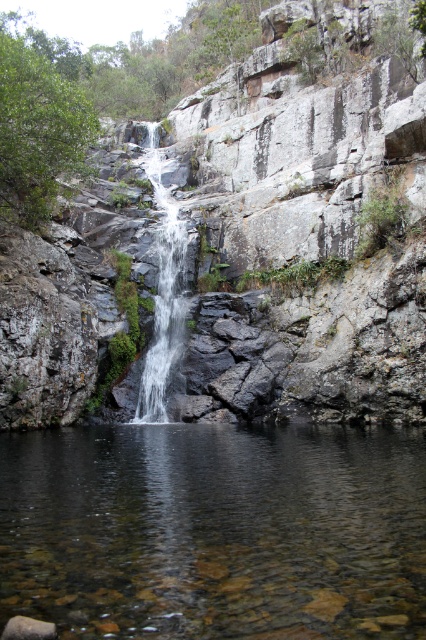
Question: Which object is closer to the camera taking this photo?

Choices:
 (A) gray rock cliff at center
 (B) clear glass waterfall at center
 (C) clear water at center

Answer: (C)

Question: Can you confirm if gray rock cliff at center is positioned to the left of clear glass waterfall at center?

Choices:
 (A) no
 (B) yes

Answer: (A)

Question: Does gray rock cliff at center appear under clear water at center?

Choices:
 (A) yes
 (B) no

Answer: (B)

Question: Which point is closer to the camera?

Choices:
 (A) (273, 362)
 (B) (149, 152)
 (C) (112, 577)

Answer: (C)

Question: Does gray rock cliff at center appear under clear glass waterfall at center?

Choices:
 (A) yes
 (B) no

Answer: (B)

Question: Among these points, which one is nearest to the camera?

Choices:
 (A) (230, 113)
 (B) (304, 595)
 (C) (154, 186)

Answer: (B)